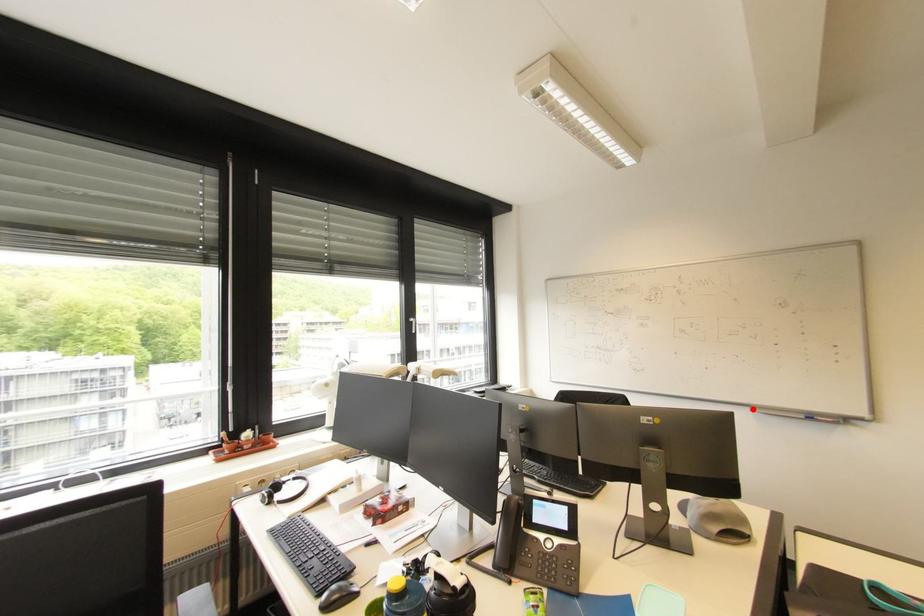
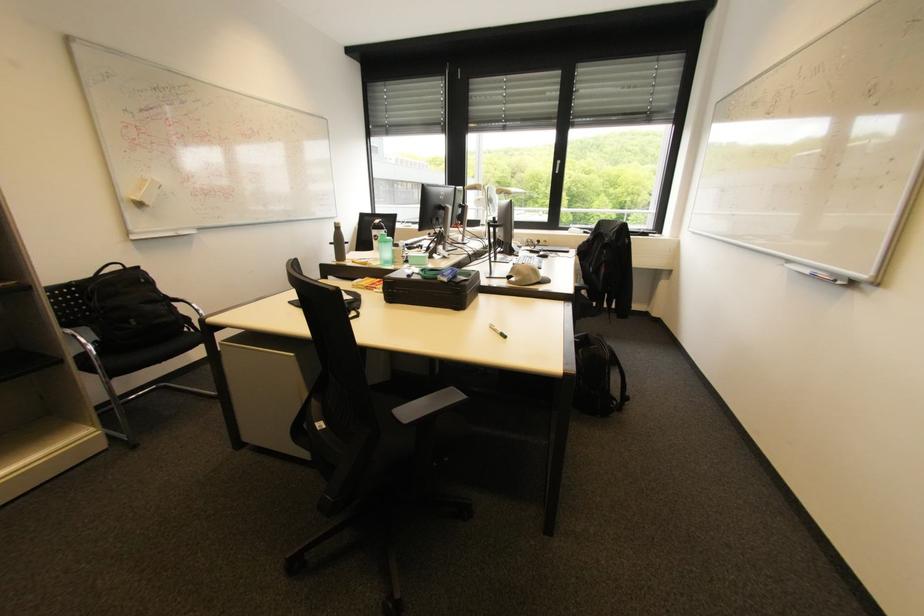
In the second image, find the point that corresponds to the highlighted location in the first image.

(789, 262)